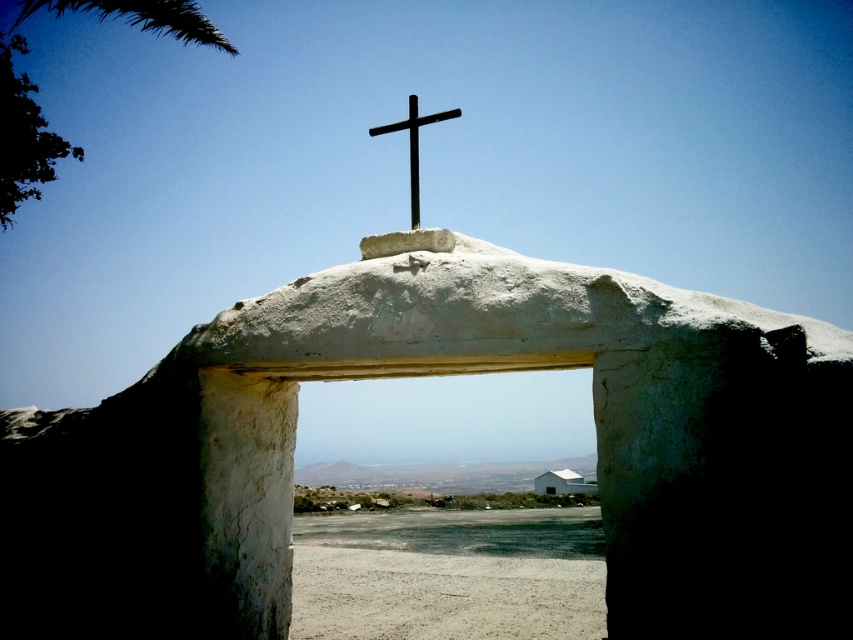
Who is more distant from viewer, (140, 4) or (413, 150)?

Point (140, 4)

Can you confirm if green leafy palm tree at upper left is positioned to the right of black metal cross at center?

No, green leafy palm tree at upper left is not to the right of black metal cross at center.

Is point (3, 42) in front of point (415, 170)?

No, (3, 42) is further to viewer.

Find the location of `green leafy palm tree at upper left`. green leafy palm tree at upper left is located at coordinates (38, 90).